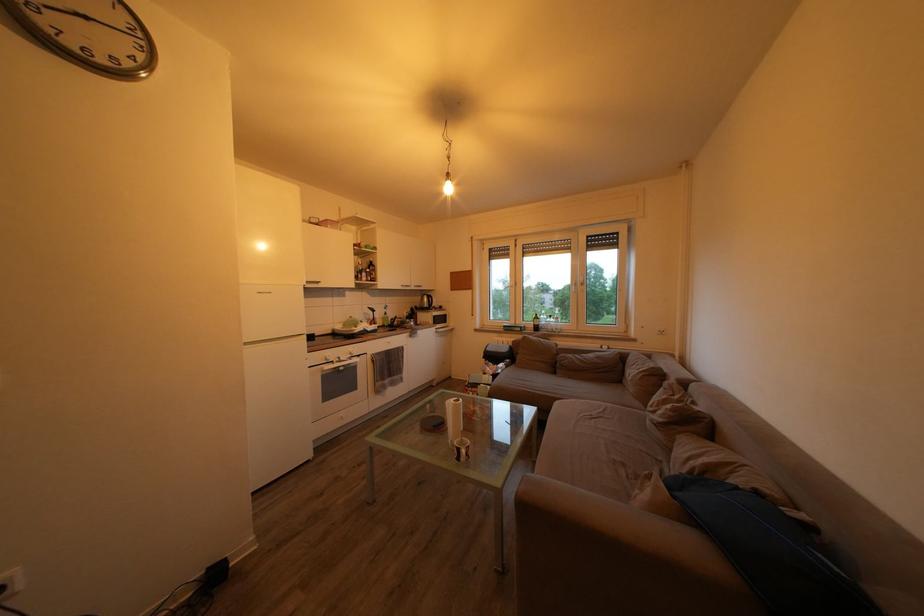
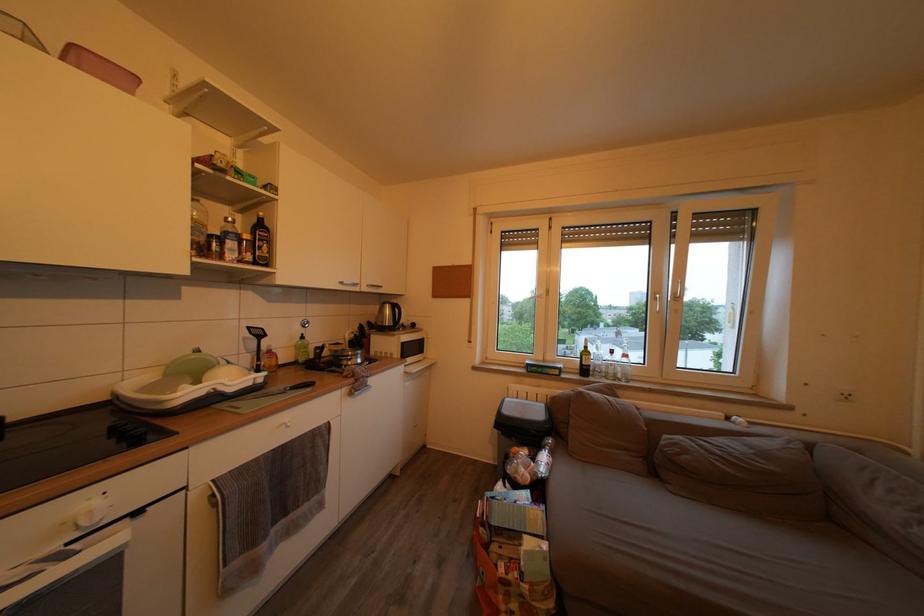
Where in the second image is the point corresponding to point 377,336 from the first image?

(238, 397)